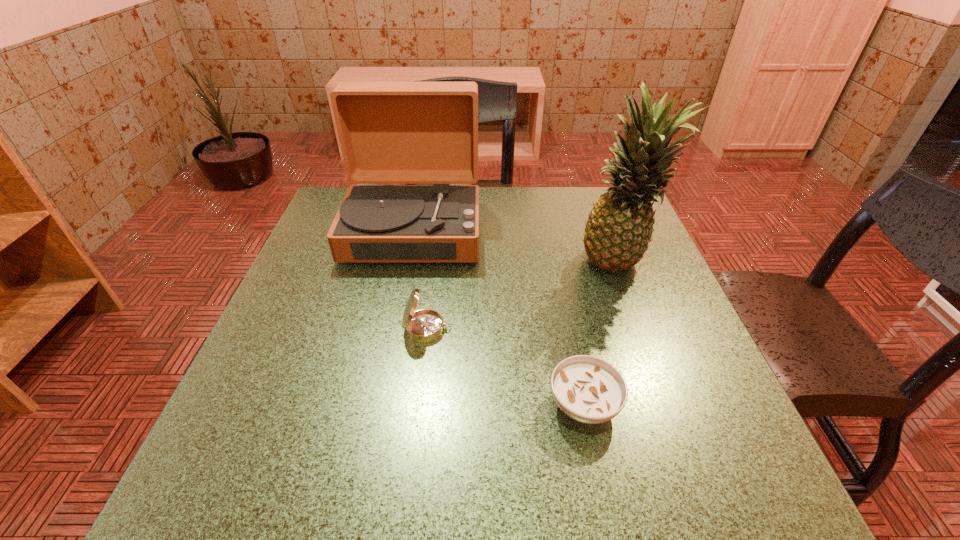
Where is `free space between the tallest object and the phonograph record`? free space between the tallest object and the phonograph record is located at coordinates (516, 247).

Image resolution: width=960 pixels, height=540 pixels. What are the coordinates of `free space between the second nearest object and the second tallest object` in the screenshot? It's located at (420, 279).

Locate an element on the screen. The height and width of the screenshot is (540, 960). vacant region between the phonograph record and the pineapple is located at coordinates (516, 247).

Where is `free spot between the nearest object and the phonograph record`? The height and width of the screenshot is (540, 960). free spot between the nearest object and the phonograph record is located at coordinates (498, 317).

Locate an element on the screen. The image size is (960, 540). free space between the pineapple and the second nearest object is located at coordinates (523, 297).

Where is `vacant space in between the phonograph record and the nearest object`? vacant space in between the phonograph record and the nearest object is located at coordinates (498, 317).

Locate an element on the screen. The width and height of the screenshot is (960, 540). free area in between the third shortest object and the shortest object is located at coordinates (498, 317).

This screenshot has width=960, height=540. I want to click on unoccupied position between the pineapple and the phonograph record, so click(x=516, y=247).

Image resolution: width=960 pixels, height=540 pixels. Identify the location of vacant area that lies between the second nearest object and the pineapple. (523, 297).

Locate an element on the screen. The image size is (960, 540). object that is the closest one to the pineapple is located at coordinates (588, 389).